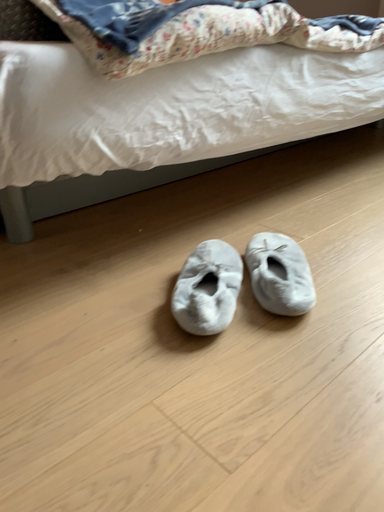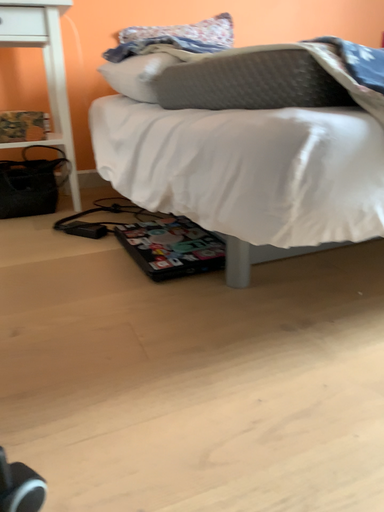
Question: Which way did the camera rotate in the video?

Choices:
 (A) rotated left
 (B) rotated right

Answer: (A)